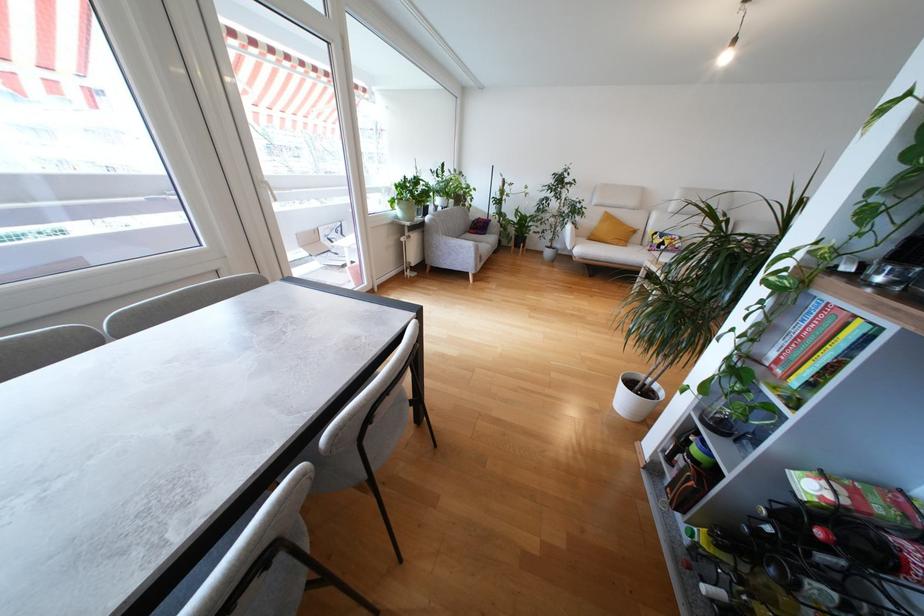
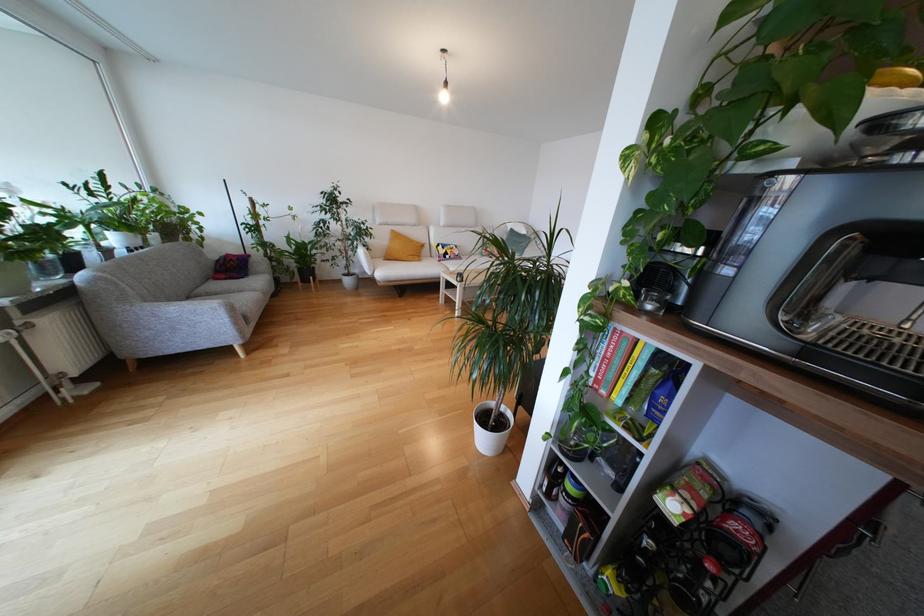
In the second image, find the point that corresponds to (x=730, y=60) in the first image.

(448, 100)